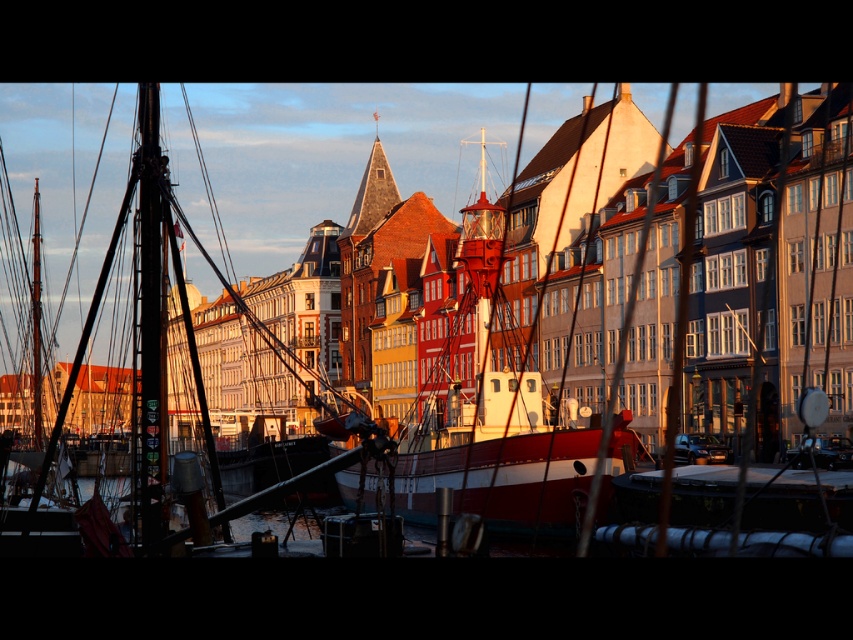
Who is more distant from viewer, (x=467, y=499) or (x=115, y=224)?

The point (x=115, y=224) is behind.

Does red matte/lightweight boat at center have a greater width compared to wooden ship at left?

Incorrect, red matte/lightweight boat at center's width does not surpass wooden ship at left's.

Describe the element at coordinates (490, 384) in the screenshot. I see `red matte/lightweight boat at center` at that location.

Find the location of `red matte/lightweight boat at center`. red matte/lightweight boat at center is located at coordinates (490, 384).